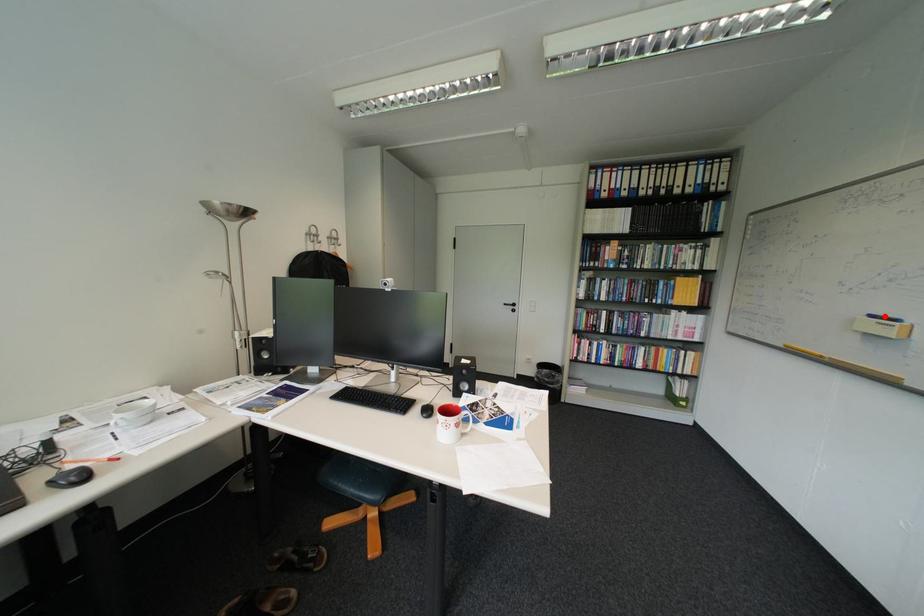
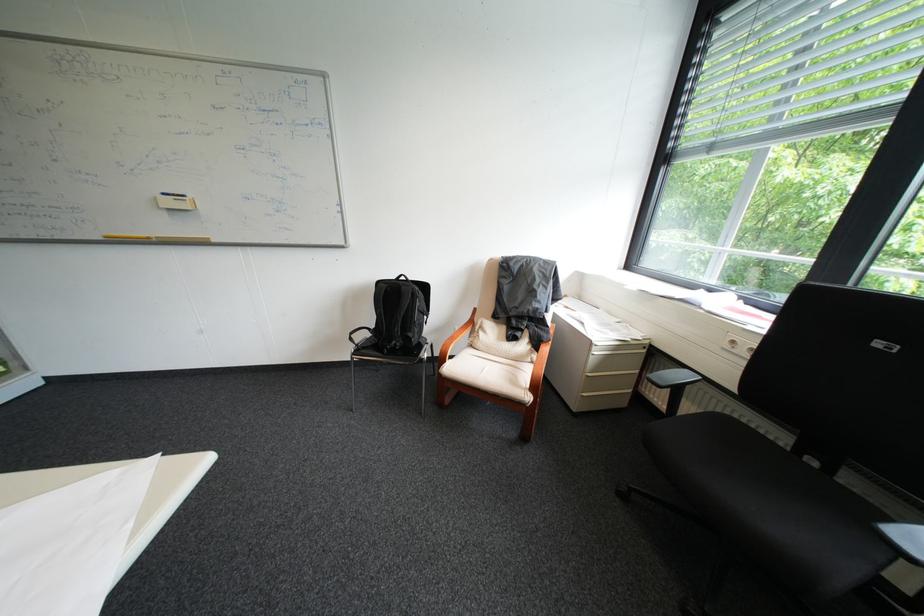
Find the pixel in the second image that matches the highlighted location in the first image.

(176, 195)